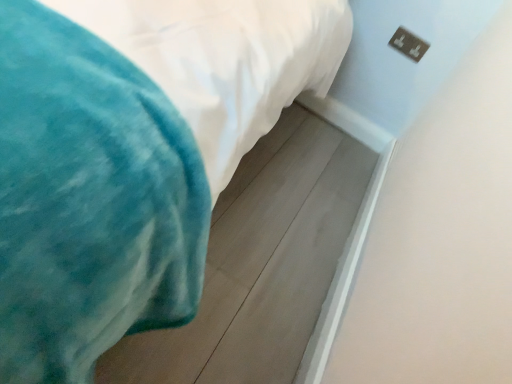
Question: Considering the positions of point (95, 276) and point (394, 39), is point (95, 276) closer or farther from the camera than point (394, 39)?

Choices:
 (A) farther
 (B) closer

Answer: (B)

Question: Is velvet teal blanket at lower left in front of or behind metallic silver outlet at upper right in the image?

Choices:
 (A) behind
 (B) front

Answer: (B)

Question: Choose the correct answer: Is velvet teal blanket at lower left inside metallic silver outlet at upper right or outside it?

Choices:
 (A) outside
 (B) inside

Answer: (A)

Question: Considering the positions of metallic silver outlet at upper right and velvet teal blanket at lower left in the image, is metallic silver outlet at upper right wider or thinner than velvet teal blanket at lower left?

Choices:
 (A) thin
 (B) wide

Answer: (A)

Question: From the image's perspective, relative to velvet teal blanket at lower left, is metallic silver outlet at upper right above or below?

Choices:
 (A) above
 (B) below

Answer: (A)

Question: Looking at the image, does metallic silver outlet at upper right seem bigger or smaller compared to velvet teal blanket at lower left?

Choices:
 (A) big
 (B) small

Answer: (B)

Question: In terms of height, does metallic silver outlet at upper right look taller or shorter compared to velvet teal blanket at lower left?

Choices:
 (A) short
 (B) tall

Answer: (B)